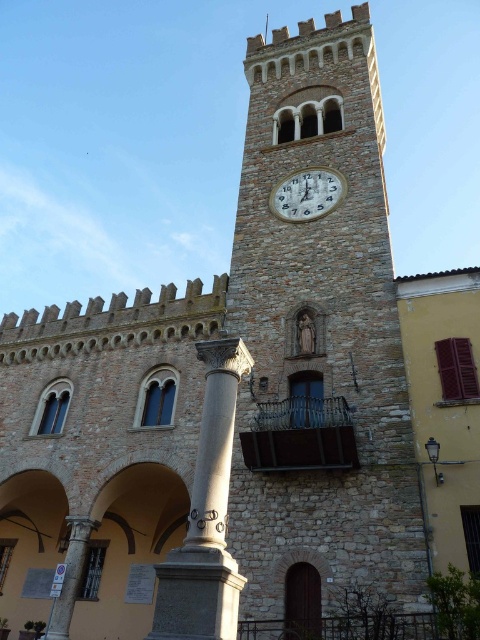
Question: Is smooth stone column at center to the left of white glossy clock at center from the viewer's perspective?

Choices:
 (A) yes
 (B) no

Answer: (A)

Question: Is smooth stone column at center wider than white glossy clock at center?

Choices:
 (A) yes
 (B) no

Answer: (A)

Question: In this image, where is smooth stone column at center located relative to white glossy clock at center?

Choices:
 (A) below
 (B) above

Answer: (A)

Question: Which point is farther to the camera?

Choices:
 (A) white glossy clock at center
 (B) smooth stone column at center

Answer: (A)